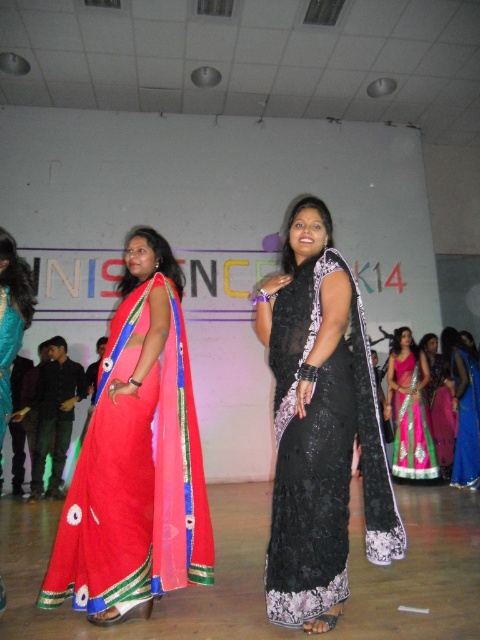
Question: Which point appears farthest from the camera in this image?

Choices:
 (A) (108, 406)
 (B) (10, 292)

Answer: (B)

Question: Which point is closer to the camera?

Choices:
 (A) black lace saree at center
 (B) shiny blue saree at right
 (C) black sequined saree at center

Answer: (C)

Question: Where is black sequined saree at center located in relation to shiny blue saree at right in the image?

Choices:
 (A) left
 (B) right

Answer: (A)

Question: Can you confirm if black sequined saree at center is smaller than black lace saree at center?

Choices:
 (A) no
 (B) yes

Answer: (A)

Question: Where is black sequined saree at center located in relation to shiny teal saree at left in the image?

Choices:
 (A) left
 (B) right

Answer: (B)

Question: Which is farther from the shiny teal saree at left?

Choices:
 (A) matte red saree at left
 (B) pink satin saree at center
 (C) shiny blue saree at right

Answer: (C)